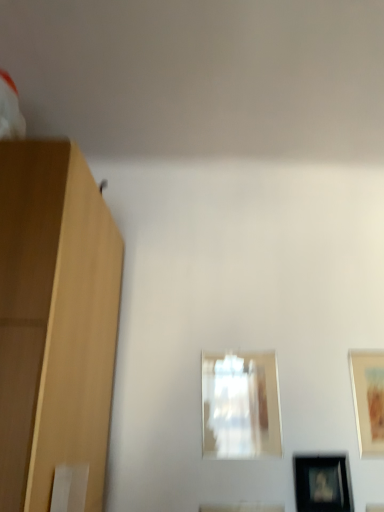
Question: Is point (311, 476) positioned closer to the camera than point (377, 421)?

Choices:
 (A) closer
 (B) farther

Answer: (A)

Question: Do you think black glossy picture frame at lower right, positioned as the second picture frame in right-to-left order, is within matte wooden picture frame at right, which ranks as the 1th picture frame in right-to-left order, or outside of it?

Choices:
 (A) outside
 (B) inside

Answer: (A)

Question: Estimate the real-world distances between objects in this image. Which object is farther from the transparent glass picture frame at center, which is the 3th picture frame from right to left?

Choices:
 (A) black glossy picture frame at lower right, positioned as the second picture frame in right-to-left order
 (B) matte wooden picture frame at right, which ranks as the 1th picture frame in right-to-left order

Answer: (B)

Question: Which object is the closest to the matte wooden picture frame at right, placed as the 3th picture frame when sorted from left to right?

Choices:
 (A) black glossy picture frame at lower right, positioned as the second picture frame in right-to-left order
 (B) transparent glass picture frame at center, the 1th picture frame positioned from the left

Answer: (A)